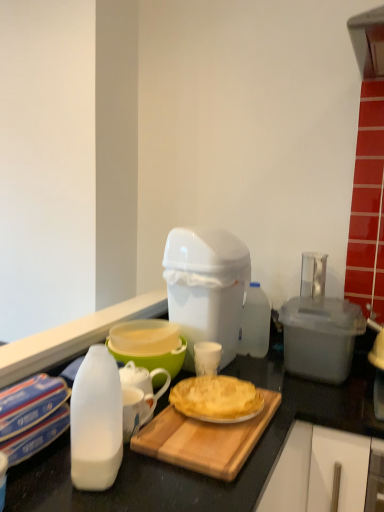
Question: Are wooden cutting board at center and green plastic bowl at center making contact?

Choices:
 (A) no
 (B) yes

Answer: (A)

Question: Considering the relative sizes of wooden cutting board at center and green plastic bowl at center in the image provided, is wooden cutting board at center smaller than green plastic bowl at center?

Choices:
 (A) yes
 (B) no

Answer: (A)

Question: Would you say wooden cutting board at center is outside green plastic bowl at center?

Choices:
 (A) no
 (B) yes

Answer: (B)

Question: Is green plastic bowl at center at the back of wooden cutting board at center?

Choices:
 (A) yes
 (B) no

Answer: (B)

Question: Considering the relative sizes of wooden cutting board at center and green plastic bowl at center in the image provided, is wooden cutting board at center bigger than green plastic bowl at center?

Choices:
 (A) yes
 (B) no

Answer: (B)

Question: Is wooden cutting board at center wider than green plastic bowl at center?

Choices:
 (A) no
 (B) yes

Answer: (B)

Question: Is transparent plastic container at right, placed as the 2th appliance when sorted from left to right, in contact with golden flaky pie at center?

Choices:
 (A) no
 (B) yes

Answer: (A)

Question: Is transparent plastic container at right, placed as the 2th appliance when sorted from left to right, shorter than golden flaky pie at center?

Choices:
 (A) no
 (B) yes

Answer: (A)

Question: From the image's perspective, would you say transparent plastic container at right, the first appliance positioned from the right, is positioned over golden flaky pie at center?

Choices:
 (A) no
 (B) yes

Answer: (B)

Question: From a real-world perspective, does transparent plastic container at right, placed as the 2th appliance when sorted from left to right, stand above golden flaky pie at center?

Choices:
 (A) yes
 (B) no

Answer: (A)

Question: From a real-world perspective, is transparent plastic container at right, the first appliance positioned from the right, physically below golden flaky pie at center?

Choices:
 (A) yes
 (B) no

Answer: (B)

Question: Can you confirm if transparent plastic container at right, the first appliance positioned from the right, is wider than golden flaky pie at center?

Choices:
 (A) yes
 (B) no

Answer: (B)

Question: Is white plastic trash can at center, the first appliance when ordered from left to right, not near transparent plastic container at right, the first appliance positioned from the right?

Choices:
 (A) yes
 (B) no

Answer: (B)